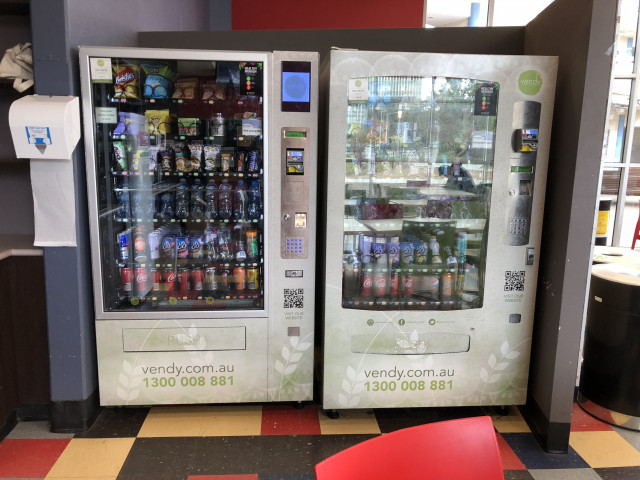
Where is `paper towel`? paper towel is located at coordinates (49, 179).